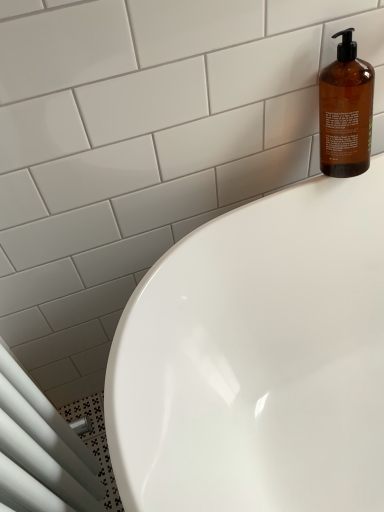
What is the approximate width of amber glass bottle at upper right?

amber glass bottle at upper right is 4.73 inches in width.

What do you see at coordinates (346, 111) in the screenshot? The height and width of the screenshot is (512, 384). I see `amber glass bottle at upper right` at bounding box center [346, 111].

Identify the location of amber glass bottle at upper right. (346, 111).

The image size is (384, 512). I want to click on amber glass bottle at upper right, so click(x=346, y=111).